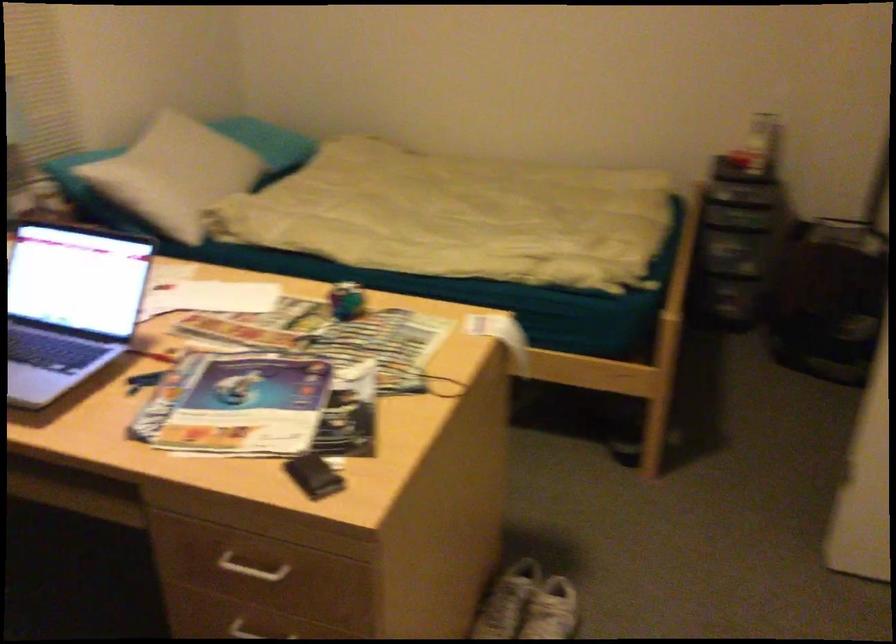
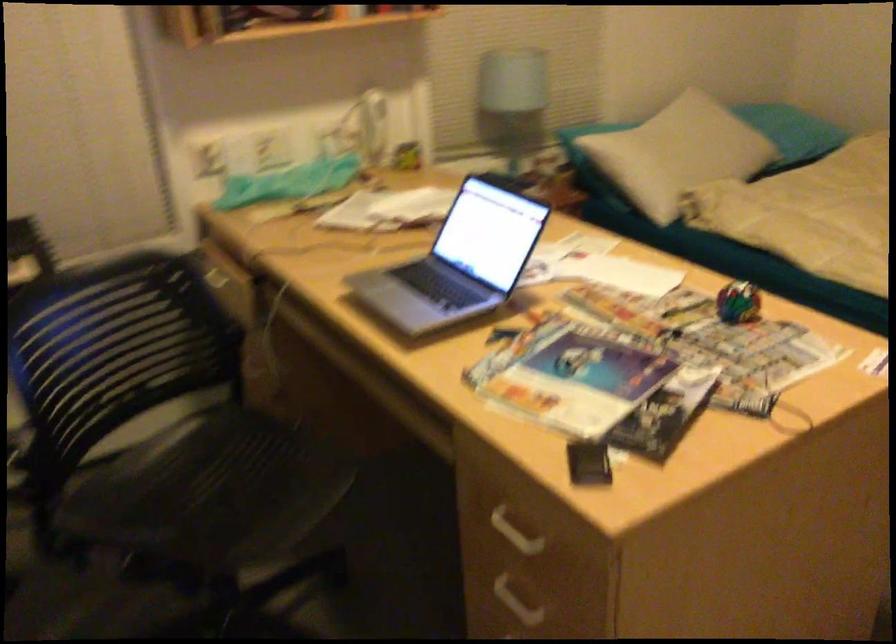
Question: Based on the continuous images, in which direction is the camera rotating? Reply with the corresponding letter.

Choices:
 (A) Left
 (B) Right
 (C) Up
 (D) Down

Answer: (A)